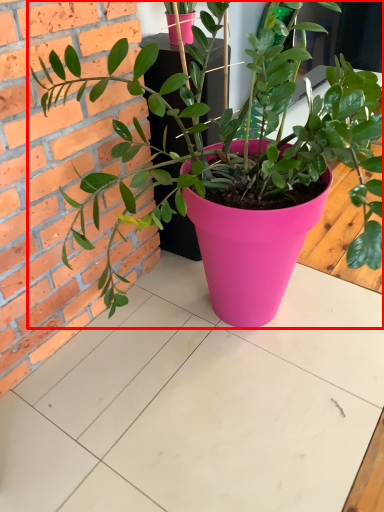
Question: Observing the image, what is the correct spatial positioning of houseplant (annotated by the red box) in reference to table?

Choices:
 (A) right
 (B) left

Answer: (B)